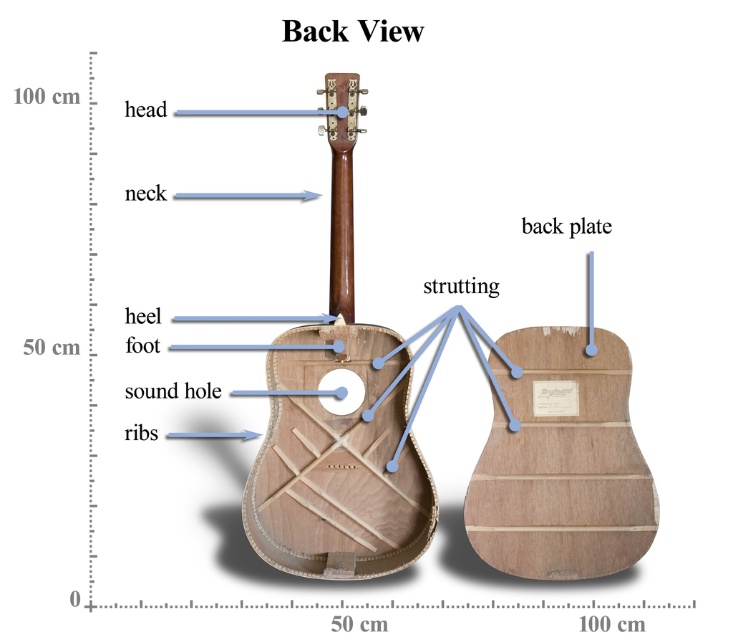
Does natural wood guitar at center appear on the right side of natural wood strutting at center?

In fact, natural wood guitar at center is to the left of natural wood strutting at center.

Which of these two, natural wood guitar at center or natural wood strutting at center, stands taller?

natural wood guitar at center is taller.

Is point (316, 444) positioned after point (556, 573)?

Yes, it is behind point (556, 573).

Where is `natural wood guitar at center`? This screenshot has width=733, height=640. natural wood guitar at center is located at coordinates (335, 413).